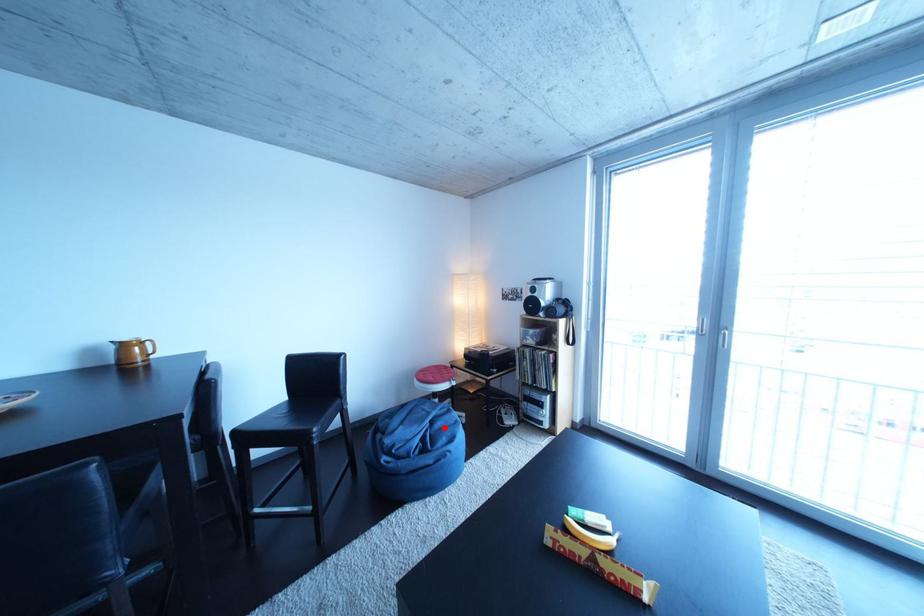
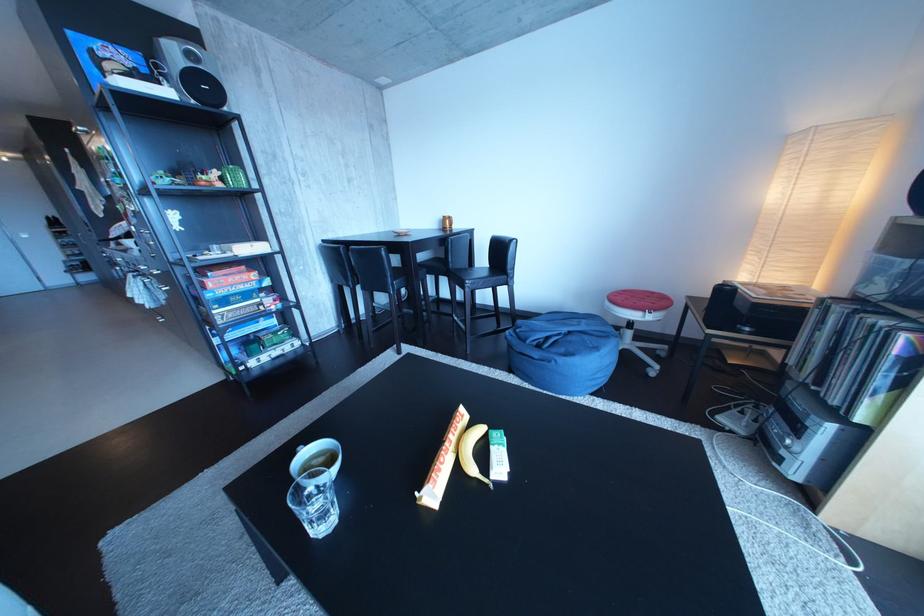
The point at the highlighted location is marked in the first image. Where is the corresponding point in the second image?

(582, 339)